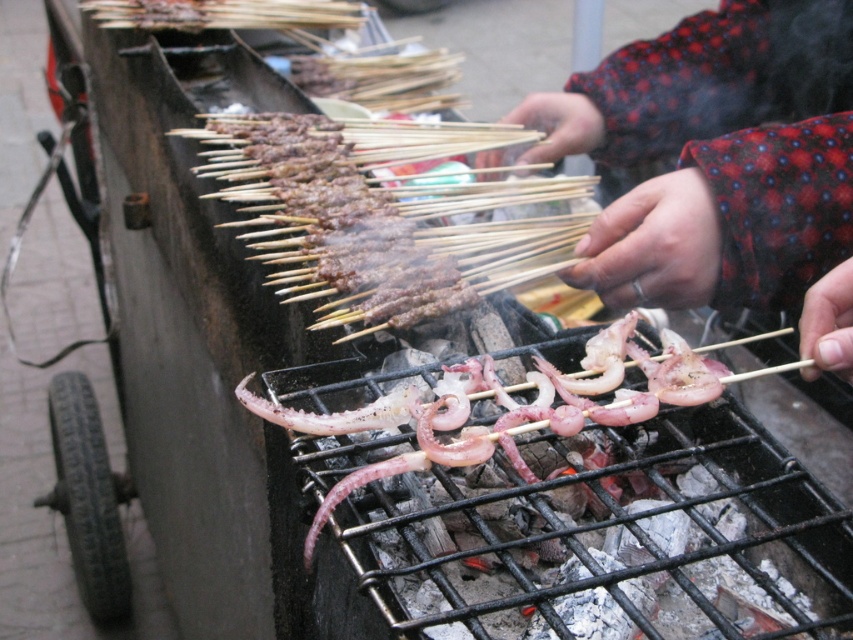
Question: Can you confirm if red dotted sweater at center is bigger than brown charred skewers at center?

Choices:
 (A) no
 (B) yes

Answer: (A)

Question: Which point is closer to the camera?

Choices:
 (A) click(390, 276)
 (B) click(363, 428)
 (C) click(811, 312)

Answer: (C)

Question: Which point appears closest to the camera in this image?

Choices:
 (A) (405, 240)
 (B) (749, 6)

Answer: (A)

Question: Is brown charred skewers at center to the left of pink translucent squid at center from the viewer's perspective?

Choices:
 (A) yes
 (B) no

Answer: (A)

Question: Observing the image, what is the correct spatial positioning of brown charred skewers at center in reference to pink translucent squid at center?

Choices:
 (A) below
 (B) above

Answer: (B)

Question: Which of the following is the farthest from the observer?

Choices:
 (A) red dotted sweater at center
 (B) brown charred skewers at center
 (C) pink translucent squid at center

Answer: (B)